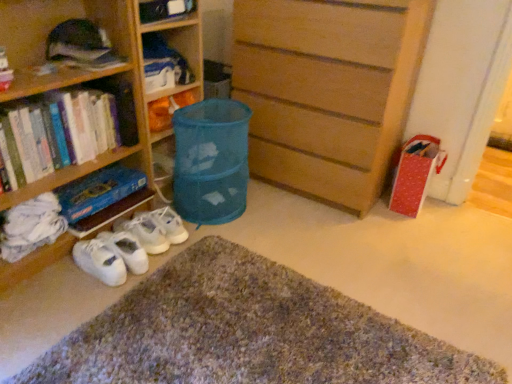
At what (x,y) coordinates should I click in order to perform the action: click on free space in front of white fabric sneakers at lower left. Please return your answer as a coordinate pair (x, y). The width and height of the screenshot is (512, 384). Looking at the image, I should click on (89, 302).